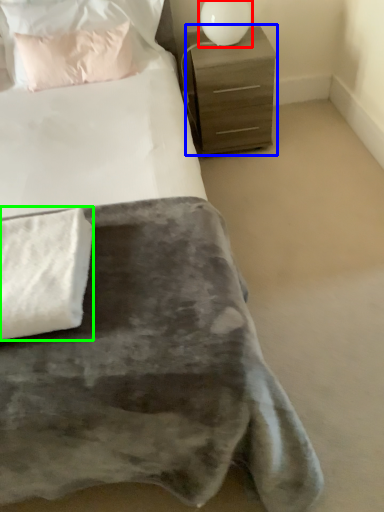
Question: Considering the real-world distances, which object is farthest from table lamp (highlighted by a red box)? chest of drawers (highlighted by a blue box) or blanket (highlighted by a green box)?

Choices:
 (A) chest of drawers
 (B) blanket

Answer: (B)